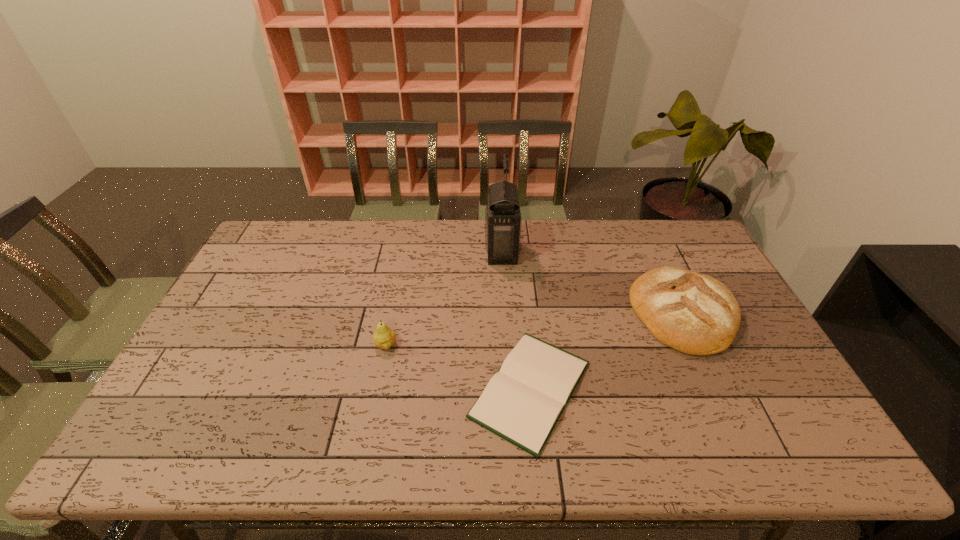
The image size is (960, 540). What are the coordinates of `vacant space located on the right of the shortest object` in the screenshot? It's located at (692, 389).

Where is `object that is at the far edge`? This screenshot has width=960, height=540. object that is at the far edge is located at coordinates (503, 221).

Identify the location of object that is at the near edge. The image size is (960, 540). (522, 403).

Locate an element on the screen. Image resolution: width=960 pixels, height=540 pixels. object positioned at the right edge is located at coordinates (691, 312).

Identify the location of free space at the far edge of the desktop. This screenshot has width=960, height=540. pyautogui.click(x=328, y=237).

Where is `vacant region at the near edge of the desktop`? vacant region at the near edge of the desktop is located at coordinates (719, 437).

Image resolution: width=960 pixels, height=540 pixels. I want to click on free space at the left edge of the desktop, so click(x=265, y=321).

This screenshot has height=540, width=960. In order to click on vacant area at the right edge of the desktop in this screenshot , I will do `click(755, 338)`.

What are the coordinates of `vacant space at the near left corner` in the screenshot? It's located at (147, 449).

You are a GUI agent. You are given a task and a screenshot of the screen. Output one action in this format:
    pyautogui.click(x=<x>, y=<y>)
    Task: Click on the free space at the far right corner of the desktop
    The width and height of the screenshot is (960, 540).
    Given the screenshot: What is the action you would take?
    pyautogui.click(x=673, y=226)